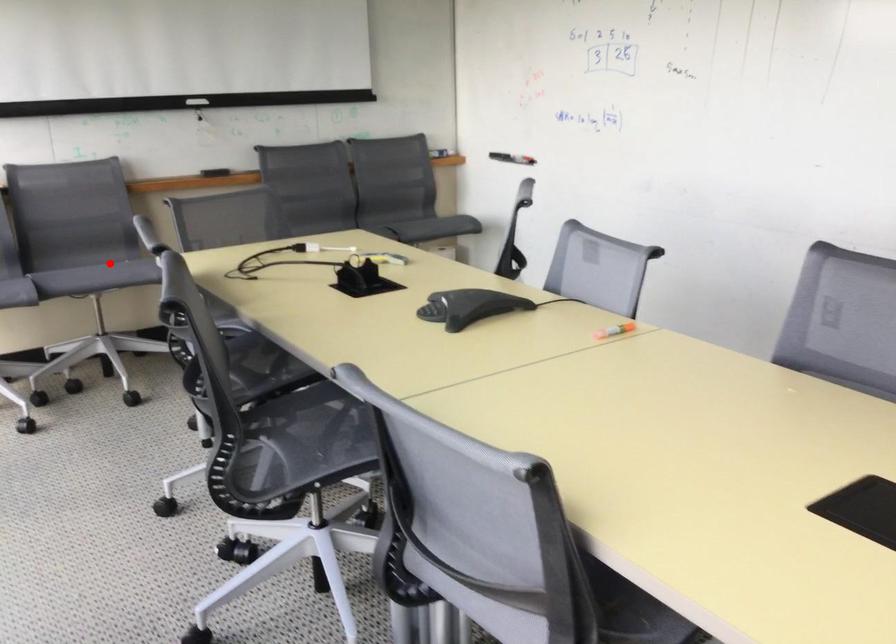
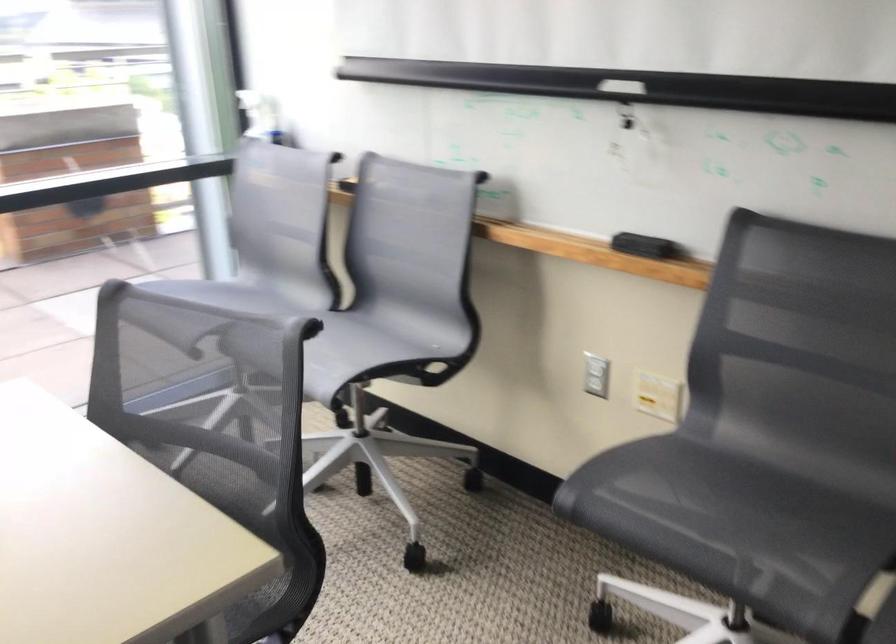
Where in the second image is the point corresponding to the highlighted location from the first image?

(348, 351)